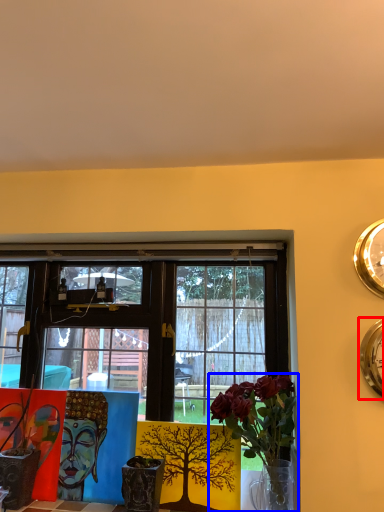
Question: Which point is further to the camera, clock (highlighted by a red box) or houseplant (highlighted by a blue box)?

Choices:
 (A) clock
 (B) houseplant

Answer: (A)